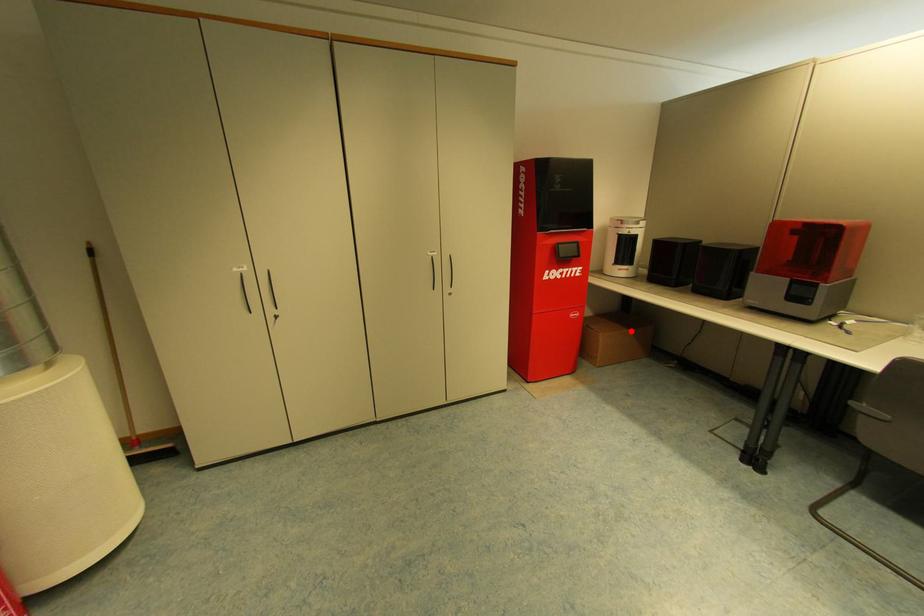
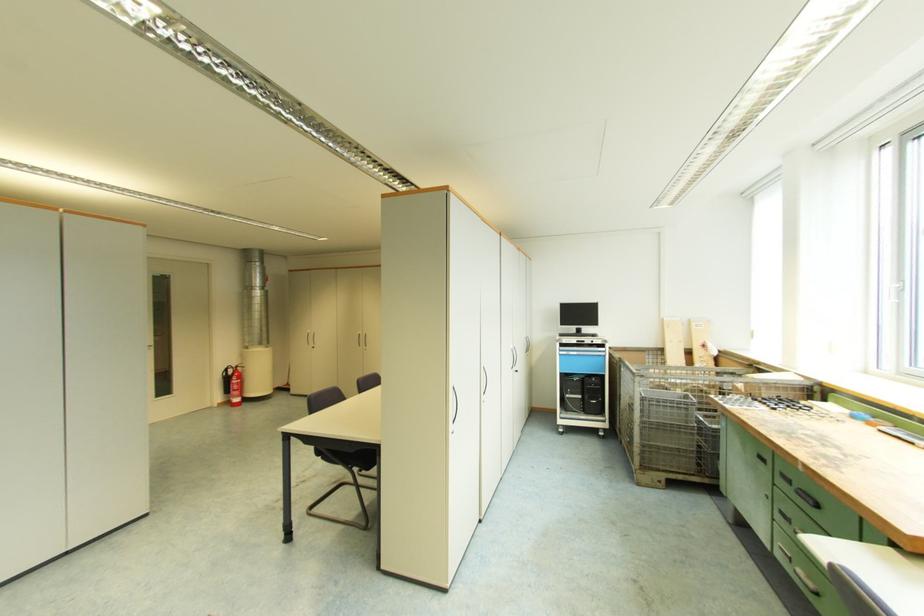
Question: I am providing you with two images of the same scene from different viewpoints. A red point is marked on the first image. Can you still see the location of the red point in image 2?

Choices:
 (A) Yes
 (B) No

Answer: (B)